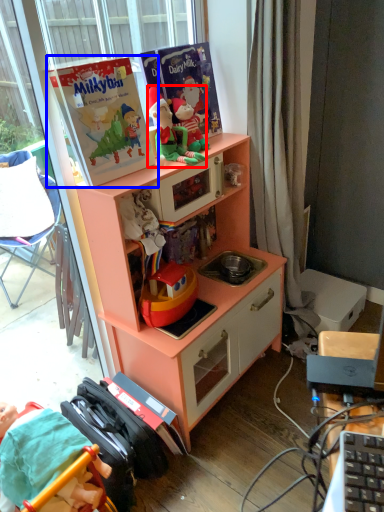
Question: Among these objects, which one is farthest to the camera, person (highlighted by a red box) or paperback book (highlighted by a blue box)?

Choices:
 (A) person
 (B) paperback book

Answer: (A)